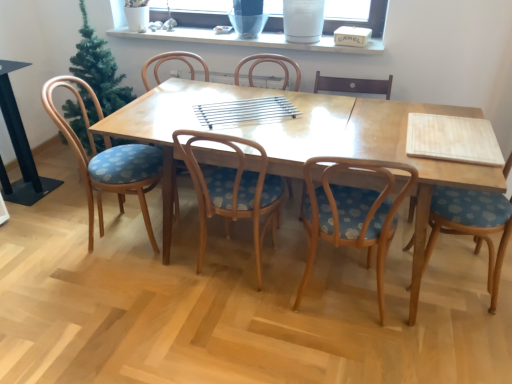
You are a GUI agent. You are given a task and a screenshot of the screen. Output one action in this format:
    pyautogui.click(x=<x>, y=<y>)
    Task: Click on the vacant position to the left of wooden chair with blue floral cushion at left, acting as the sixth chair starting from the right
    The width and height of the screenshot is (512, 384).
    Given the screenshot: What is the action you would take?
    pyautogui.click(x=46, y=250)